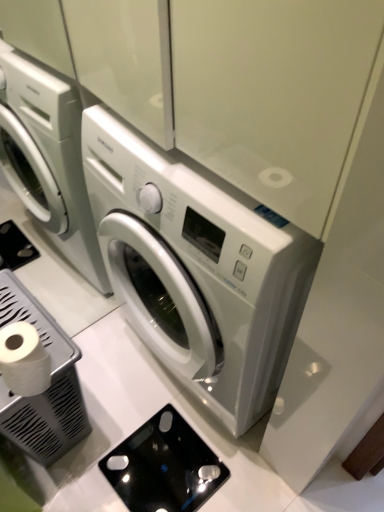
The height and width of the screenshot is (512, 384). Identify the location of vacant space that's between white glossy washing machine at center and black glass scale at lower center, acting as the 2th appliance starting from the left. (133, 391).